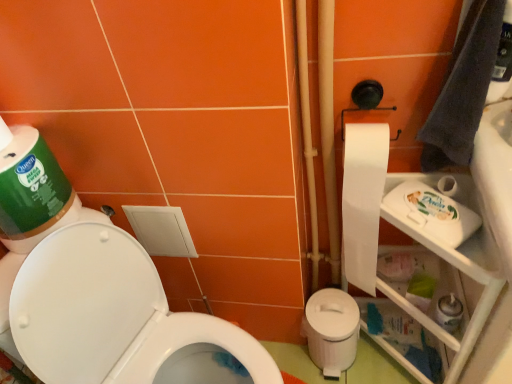
The image size is (512, 384). Identify the location of vacant point above white plastic shelf at right (from a real-world perspective). (422, 208).